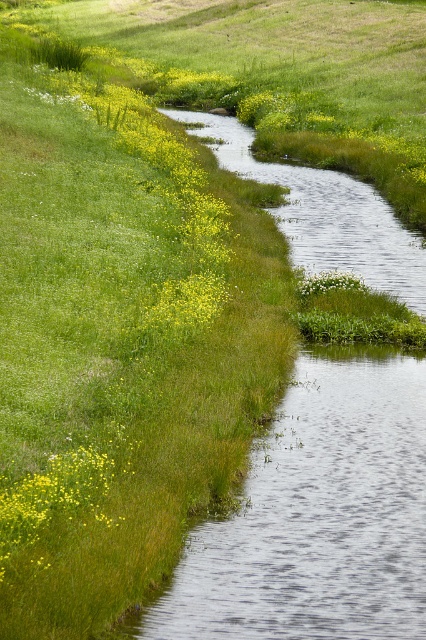
Question: Which is nearer to the yellow matte flower at center-left?

Choices:
 (A) white matte flower at center
 (B) yellow matte flower at lower left

Answer: (A)

Question: Is yellow matte flower at center-left behind white matte flower at center?

Choices:
 (A) yes
 (B) no

Answer: (B)

Question: Which of the following is the closest to the observer?

Choices:
 (A) yellow matte flower at lower left
 (B) white matte flower at center

Answer: (A)

Question: Can you confirm if yellow matte flower at lower left is smaller than white matte flower at center?

Choices:
 (A) yes
 (B) no

Answer: (B)

Question: Which point is farther from the camera taking this photo?

Choices:
 (A) (103, 513)
 (B) (158, 326)

Answer: (B)

Question: Is yellow matte flower at center-left above white matte flower at center?

Choices:
 (A) yes
 (B) no

Answer: (B)